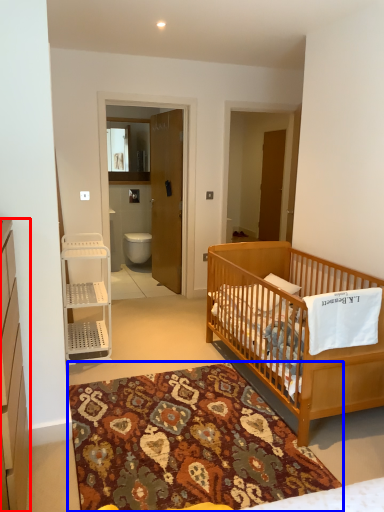
Question: Which of the following is the closest to the observer, cabinetry (highlighted by a red box) or mat (highlighted by a blue box)?

Choices:
 (A) cabinetry
 (B) mat

Answer: (A)